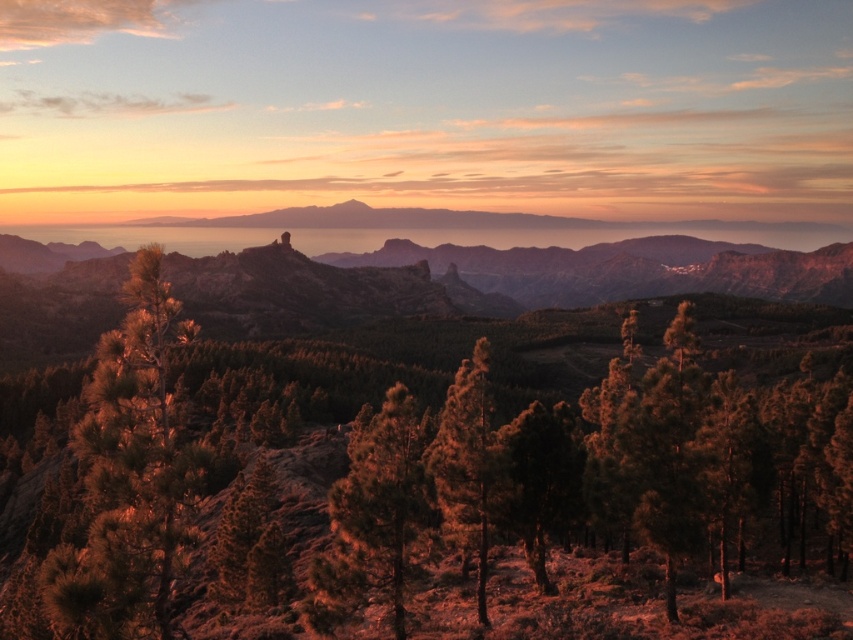
Question: Is green textured pine tree at center further to the viewer compared to brown rocky mountain range at center?

Choices:
 (A) yes
 (B) no

Answer: (B)

Question: Is brown rocky mountain range at center below green textured pine tree at left?

Choices:
 (A) yes
 (B) no

Answer: (B)

Question: Can you confirm if green textured pine tree at center is thinner than brown rocky mountain range at center?

Choices:
 (A) yes
 (B) no

Answer: (A)

Question: Which object is the closest to the green textured pine tree at center?

Choices:
 (A) green textured tree at center
 (B) green matte tree at center

Answer: (B)

Question: Which point appears farthest from the camera in this image?

Choices:
 (A) (721, 532)
 (B) (779, 296)
 (C) (183, 323)

Answer: (B)

Question: Among these points, which one is nearest to the camera?

Choices:
 (A) (775, 280)
 (B) (457, 412)
 (C) (235, 371)
 (D) (140, 470)

Answer: (D)